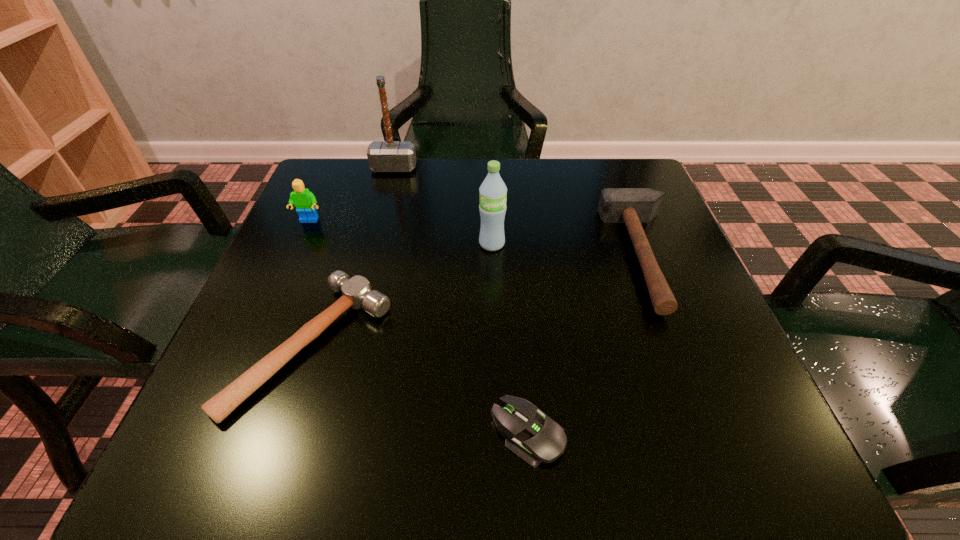
Identify the location of object positioned at the far left corner. The width and height of the screenshot is (960, 540). (383, 156).

The image size is (960, 540). I want to click on object at the near left corner, so click(357, 293).

You are a GUI agent. You are given a task and a screenshot of the screen. Output one action in this format:
    pyautogui.click(x=<x>, y=<y>)
    Task: Click on the object at the far right corner
    This screenshot has width=960, height=540.
    Given the screenshot: What is the action you would take?
    pyautogui.click(x=632, y=206)

Locate an element on the screen. vacant space at the far edge is located at coordinates (468, 161).

Find the location of a particular element. The height and width of the screenshot is (540, 960). blank area at the left edge is located at coordinates (351, 221).

Image resolution: width=960 pixels, height=540 pixels. What are the coordinates of `vacant space at the right edge` in the screenshot? It's located at (626, 308).

Where is `free region at the far left corner of the desktop`? This screenshot has width=960, height=540. free region at the far left corner of the desktop is located at coordinates (365, 215).

The height and width of the screenshot is (540, 960). In the image, there is a desktop. What are the coordinates of `vacant space at the far right corner` in the screenshot? It's located at (587, 188).

Locate an element on the screen. This screenshot has height=540, width=960. free space at the near right corner of the desktop is located at coordinates (671, 429).

Locate an element on the screen. Image resolution: width=960 pixels, height=540 pixels. free space between the shortest hammer and the second tallest object is located at coordinates click(x=402, y=294).